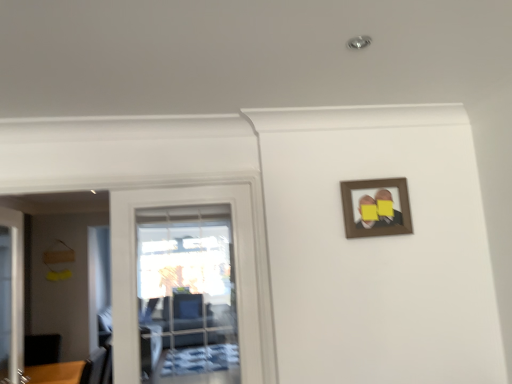
Question: Is brown wooden picture frame at upper right wider or thinner than transparent glass door at left, which is counted as the 2th door, starting from the left?

Choices:
 (A) thin
 (B) wide

Answer: (A)

Question: Considering the positions of brown wooden picture frame at upper right and transparent glass door at left, which is counted as the 2th door, starting from the left, in the image, is brown wooden picture frame at upper right taller or shorter than transparent glass door at left, which is counted as the 2th door, starting from the left,?

Choices:
 (A) tall
 (B) short

Answer: (B)

Question: Which object is positioned farthest from the white glossy door at left, which ranks as the first door in left-to-right order?

Choices:
 (A) transparent glass door at left, which is counted as the 2th door, starting from the left
 (B) brown wooden picture frame at upper right

Answer: (B)

Question: Which object is positioned farthest from the white glossy door at left, which ranks as the first door in left-to-right order?

Choices:
 (A) brown wooden picture frame at upper right
 (B) transparent glass door at left, which appears as the first door when viewed from the right

Answer: (A)